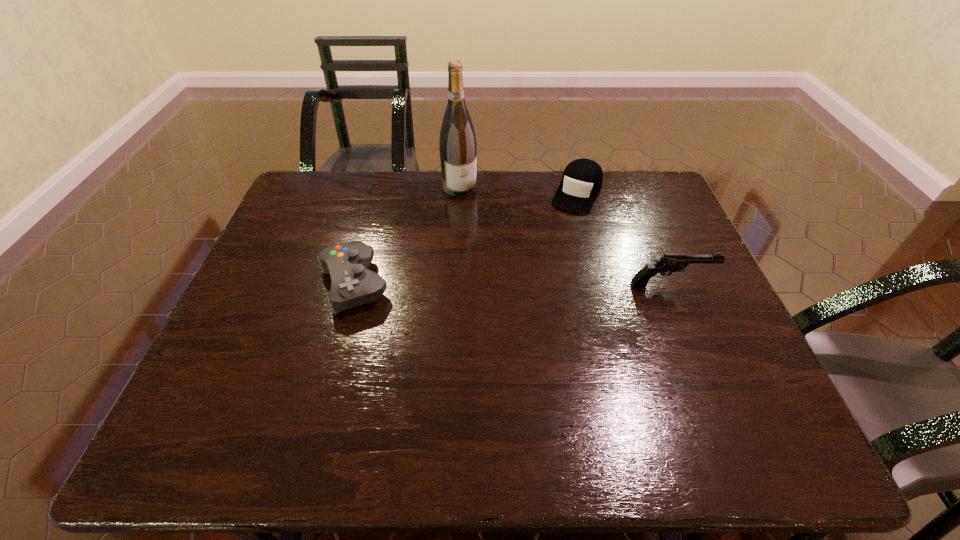
Locate an element on the screen. The width and height of the screenshot is (960, 540). vacant spot on the desktop that is between the leftmost object and the gun and is positioned on the label of the wine bottle is located at coordinates (516, 284).

Locate an element on the screen. This screenshot has height=540, width=960. vacant space on the desktop that is between the leftmost object and the gun and is positioned on the front-facing side of the cap is located at coordinates (528, 284).